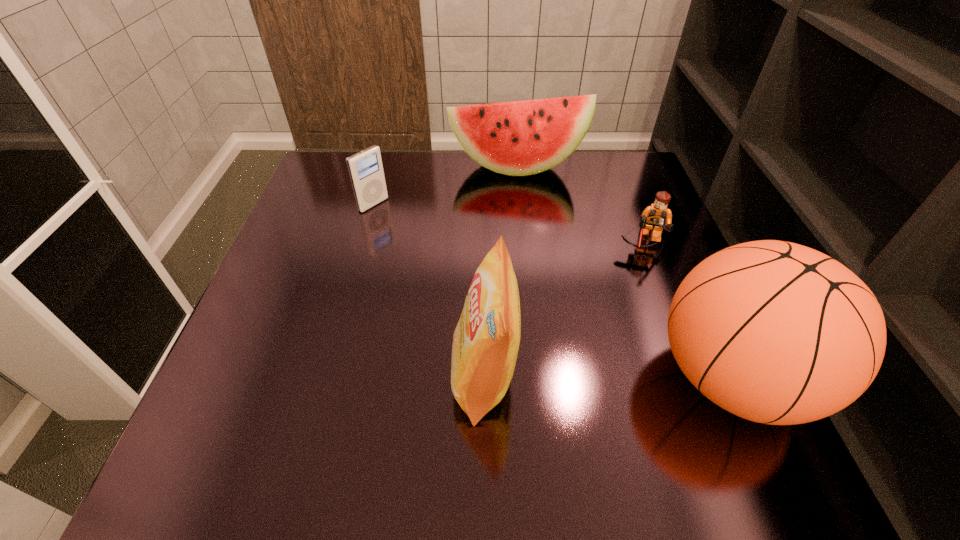
Image resolution: width=960 pixels, height=540 pixels. Find the location of `free region located 0.270m on the front-facing side of the fourth tallest object`. free region located 0.270m on the front-facing side of the fourth tallest object is located at coordinates (459, 260).

Locate an element on the screen. The height and width of the screenshot is (540, 960). watermelon located at the far edge is located at coordinates (519, 138).

Where is `iPod positioned at the far edge`? Image resolution: width=960 pixels, height=540 pixels. iPod positioned at the far edge is located at coordinates (365, 168).

You are a GUI agent. You are given a task and a screenshot of the screen. Output one action in this format:
    pyautogui.click(x=<x>, y=<y>)
    Task: Click on the crisp (potato chip) located in the near edge section of the desktop
    
    Given the screenshot: What is the action you would take?
    pyautogui.click(x=486, y=340)

Where is `basketball at the near edge`? The height and width of the screenshot is (540, 960). basketball at the near edge is located at coordinates (778, 333).

You are a GUI agent. You are given a task and a screenshot of the screen. Output one action in this format:
    pyautogui.click(x=<x>, y=<y>)
    Task: Click on the object located in the left edge section of the desktop
    
    Given the screenshot: What is the action you would take?
    pyautogui.click(x=365, y=168)

You are a GUI agent. You are given a task and a screenshot of the screen. Output one action in this format:
    pyautogui.click(x=<x>, y=<y>)
    Task: Click on the basketball present at the right edge
    Image resolution: width=960 pixels, height=540 pixels.
    Given the screenshot: What is the action you would take?
    pyautogui.click(x=778, y=333)

This screenshot has width=960, height=540. In order to click on Lego present at the right edge in this screenshot , I will do `click(656, 217)`.

Image resolution: width=960 pixels, height=540 pixels. Find the location of `object present at the far left corner`. object present at the far left corner is located at coordinates (365, 168).

You are a GUI agent. You are given a task and a screenshot of the screen. Output one action in this format:
    pyautogui.click(x=<x>, y=<y>)
    Task: Click on the object that is at the near right corner
    This screenshot has width=960, height=540.
    Given the screenshot: What is the action you would take?
    778,333